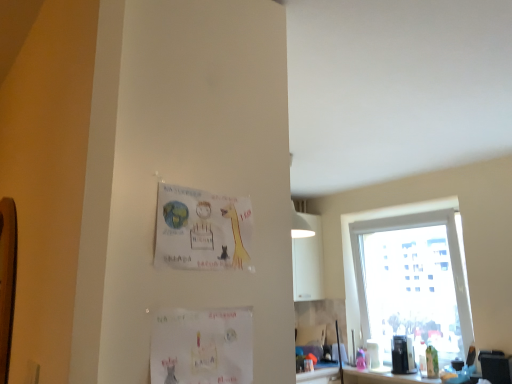
Question: Looking at the image, does wooden bulletin board at left seem bigger or smaller compared to transparent glass window at right?

Choices:
 (A) big
 (B) small

Answer: (B)

Question: Looking at their shapes, would you say wooden bulletin board at left is wider or thinner than transparent glass window at right?

Choices:
 (A) wide
 (B) thin

Answer: (B)

Question: Estimate the real-world distances between objects in this image. Which object is closer to the white paper postcard at lower center, which is counted as the 1th postcard, starting from the bottom?

Choices:
 (A) wooden bulletin board at left
 (B) transparent glass window at right
 (C) matte paper postcard at upper center, the second postcard ordered from the bottom

Answer: (C)

Question: Which is farther from the white paper postcard at lower center, which is counted as the 1th postcard, starting from the bottom?

Choices:
 (A) transparent glass window at right
 (B) wooden bulletin board at left
 (C) matte paper postcard at upper center, marked as the first postcard in a top-to-bottom arrangement

Answer: (A)